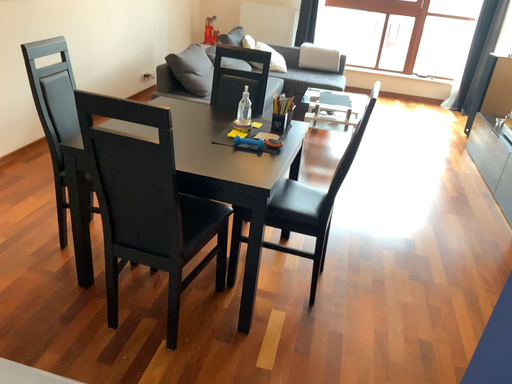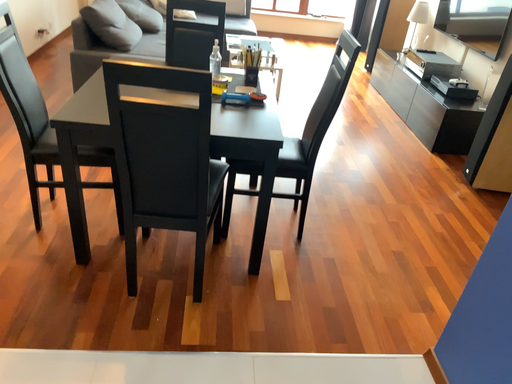
Question: How did the camera likely rotate when shooting the video?

Choices:
 (A) rotated right
 (B) rotated left

Answer: (A)